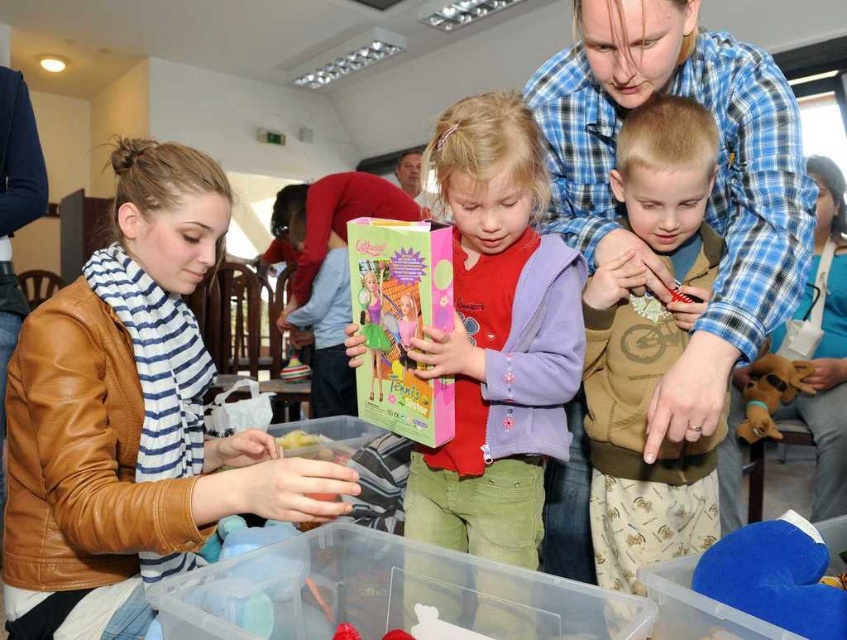
You are organizing a toy drive and need to pack items into boxes. You have a box that can only fit items smaller than the blue plaid shirt at upper center. Can the blue plush toy at lower right fit in the box?

The blue plush toy at lower right is smaller than the blue plaid shirt at upper center, so it can fit in the box designed for items smaller than the blue plaid shirt at upper center.

You are a photographer trying to capture a candid shot of the blue plaid shirt at upper center and the blue plush toy at lower right in the scene. Given that your camera has a maximum focus range of 14 inches, will you be able to focus on both subjects simultaneously?

The blue plaid shirt at upper center is 14.37 inches from the blue plush toy at lower right. Since the distance between them exceeds the camera sensor focus range of 14 inches, the camera cannot focus on both subjects simultaneously.

You are organizing a craft fair and need to place the blue fabric purse at upper right and the blue plush toy at lower right on a display table. Based on their positions in the image, which item should you place closer to the edge of the table to ensure they are arranged similarly to the original image?

The blue plush toy at lower right should be placed closer to the edge of the table since it is positioned lower and the blue fabric purse at upper right is above it in the image.